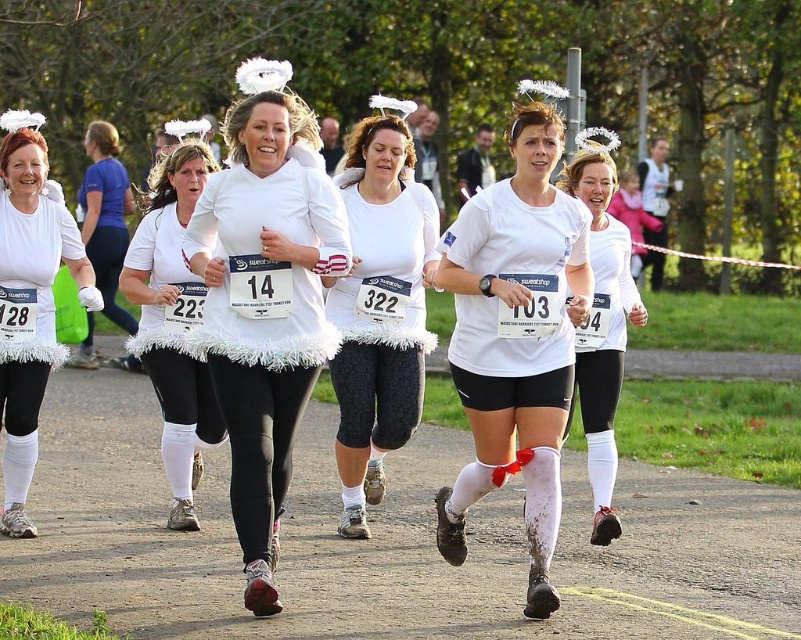
Question: Which object is the closest to the white matte t-shirt at center?

Choices:
 (A) white fluffy dress at center
 (B) white fluffy tutu at center
 (C) white fluffy skirt at left
 (D) white fluffy skirt at center

Answer: (B)

Question: Is white fluffy skirt at left closer to camera compared to white fluffy tutu at center?

Choices:
 (A) no
 (B) yes

Answer: (A)

Question: Which is nearer to the white fluffy tutu at center?

Choices:
 (A) white fluffy skirt at left
 (B) white fabric leggings at center
 (C) white fluffy skirt at center
 (D) white textured fabric at center

Answer: (D)

Question: Is white fluffy dress at center below white fluffy skirt at center?

Choices:
 (A) yes
 (B) no

Answer: (A)

Question: Which object appears farthest from the camera in this image?

Choices:
 (A) white fluffy skirt at left
 (B) white fluffy dress at center
 (C) white fluffy tutu at center
 (D) white textured fabric at center

Answer: (A)

Question: Is white fluffy skirt at left positioned behind white fluffy tutu at center?

Choices:
 (A) yes
 (B) no

Answer: (A)